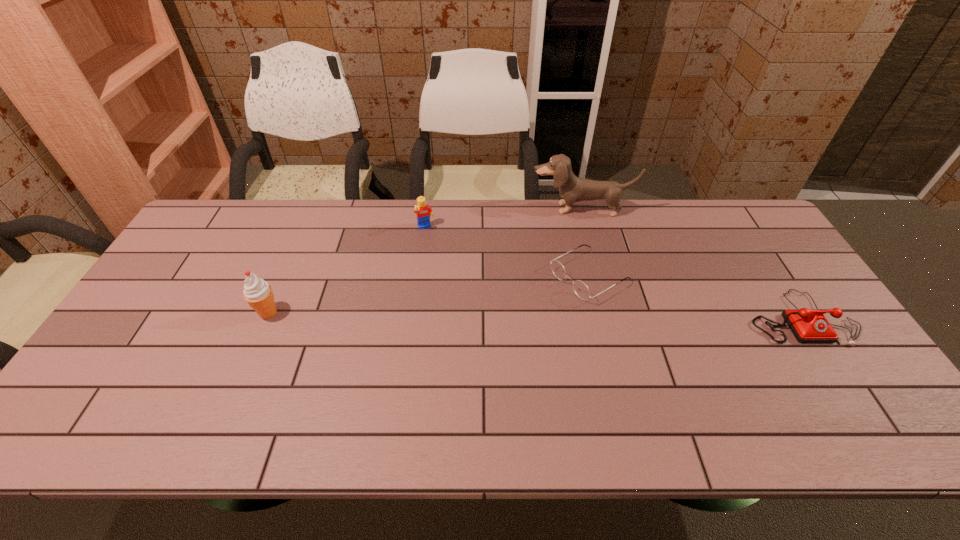
The image size is (960, 540). Find the location of `free region located 0.150m on the dial of the fourth tallest object`. free region located 0.150m on the dial of the fourth tallest object is located at coordinates (852, 401).

Where is `vacant position located on the face of the second farthest object`? This screenshot has height=540, width=960. vacant position located on the face of the second farthest object is located at coordinates (461, 309).

Image resolution: width=960 pixels, height=540 pixels. In order to click on free space located 0.140m on the face of the second farthest object in this screenshot , I will do `click(441, 262)`.

At what (x,y) coordinates should I click in order to perform the action: click on vacant space situated on the face of the second farthest object. Please return your answer as a coordinate pair (x, y). Looking at the image, I should click on (444, 273).

At what (x,y) coordinates should I click in order to perform the action: click on free location located 0.050m at the face of the puppy. Please return your answer as a coordinate pair (x, y). Looking at the image, I should click on (578, 227).

Find the location of a particular element. This screenshot has width=960, height=540. free space located at the face of the puppy is located at coordinates (581, 267).

You are a GUI agent. You are given a task and a screenshot of the screen. Output one action in this format:
    pyautogui.click(x=<x>, y=<y>)
    Task: Click on the vacant space located at the face of the puppy
    
    Given the screenshot: What is the action you would take?
    pyautogui.click(x=579, y=229)

Where is `free space located 0.280m on the front-facing side of the spectacles`? free space located 0.280m on the front-facing side of the spectacles is located at coordinates (479, 339).

This screenshot has height=540, width=960. What are the coordinates of `free space located on the front-facing side of the spectacles` in the screenshot? It's located at pos(524,313).

Where is `vacant region located on the front-facing side of the spectacles`? The width and height of the screenshot is (960, 540). vacant region located on the front-facing side of the spectacles is located at coordinates (467, 346).